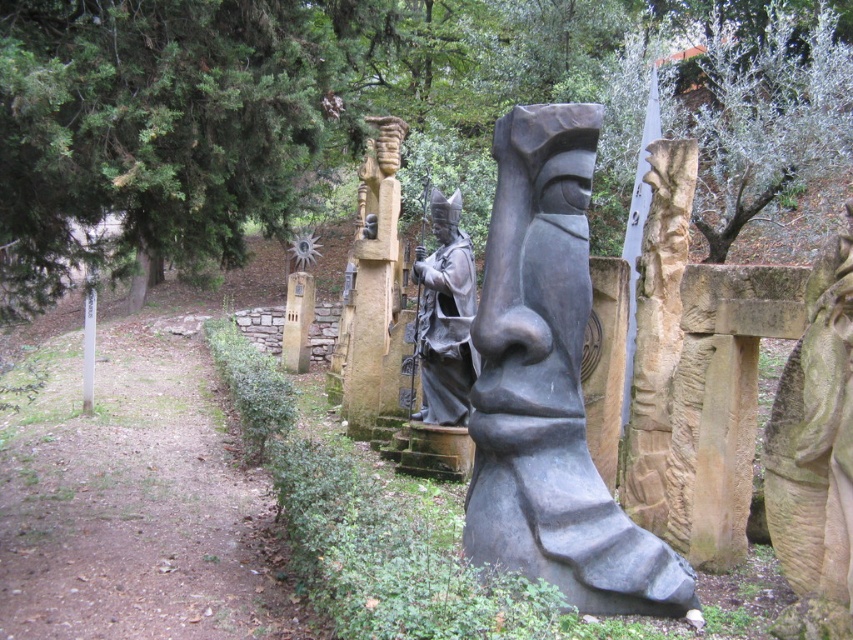
Question: Which point is closer to the camera?

Choices:
 (A) black stone statue at center
 (B) green leafy tree at center

Answer: (B)

Question: Does green leafy tree at center have a smaller size compared to matte gray statue at center?

Choices:
 (A) no
 (B) yes

Answer: (A)

Question: From the image, what is the correct spatial relationship of green textured tree at upper left in relation to dirt path at center?

Choices:
 (A) above
 (B) below

Answer: (A)

Question: Which object is positioned farthest from the black stone statue at center?

Choices:
 (A) green leafy tree at center
 (B) dirt path at center
 (C) stone statue at right
 (D) green textured tree at upper left

Answer: (A)

Question: Based on their relative distances, which object is farther from the black stone statue at center?

Choices:
 (A) green textured tree at upper left
 (B) dirt path at center

Answer: (B)

Question: Does green textured tree at upper left lie behind black stone statue at center?

Choices:
 (A) yes
 (B) no

Answer: (B)